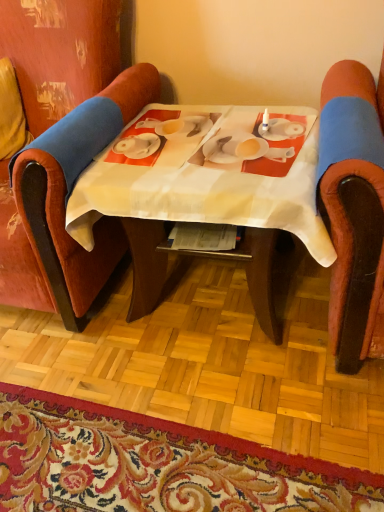
Question: From a real-world perspective, is carpet with floral pattern at lower center positioned over velvet-like orange chair at right, the second chair viewed from the left, based on gravity?

Choices:
 (A) yes
 (B) no

Answer: (B)

Question: Can you confirm if carpet with floral pattern at lower center is thinner than velvet-like orange chair at right, the second chair viewed from the left?

Choices:
 (A) no
 (B) yes

Answer: (A)

Question: Does carpet with floral pattern at lower center come in front of velvet-like orange chair at right, the second chair viewed from the left?

Choices:
 (A) yes
 (B) no

Answer: (B)

Question: Considering the relative positions of carpet with floral pattern at lower center and velvet-like orange chair at right, which is the first chair in right-to-left order, in the image provided, is carpet with floral pattern at lower center to the left of velvet-like orange chair at right, which is the first chair in right-to-left order, from the viewer's perspective?

Choices:
 (A) no
 (B) yes

Answer: (B)

Question: Does carpet with floral pattern at lower center come behind velvet-like orange chair at right, the second chair viewed from the left?

Choices:
 (A) no
 (B) yes

Answer: (B)

Question: Does carpet with floral pattern at lower center have a smaller size compared to velvet-like orange chair at right, which is the first chair in right-to-left order?

Choices:
 (A) no
 (B) yes

Answer: (B)

Question: Is the depth of velvet-like orange chair at right, the second chair viewed from the left, greater than that of carpet with floral pattern at lower center?

Choices:
 (A) no
 (B) yes

Answer: (A)

Question: Is velvet-like orange chair at right, the second chair viewed from the left, to the left of carpet with floral pattern at lower center from the viewer's perspective?

Choices:
 (A) no
 (B) yes

Answer: (A)

Question: Is carpet with floral pattern at lower center a part of velvet-like orange chair at right, the second chair viewed from the left?

Choices:
 (A) no
 (B) yes

Answer: (A)

Question: Is velvet-like orange chair at right, the second chair viewed from the left, turned away from carpet with floral pattern at lower center?

Choices:
 (A) yes
 (B) no

Answer: (B)

Question: Does velvet-like orange chair at right, which is the first chair in right-to-left order, have a lesser width compared to carpet with floral pattern at lower center?

Choices:
 (A) no
 (B) yes

Answer: (B)

Question: Could you tell me if velvet-like orange chair at right, which is the first chair in right-to-left order, is facing carpet with floral pattern at lower center?

Choices:
 (A) yes
 (B) no

Answer: (B)

Question: Is carpet with floral pattern at lower center further to the viewer compared to velvet red chair at left, acting as the second chair starting from the right?

Choices:
 (A) no
 (B) yes

Answer: (A)